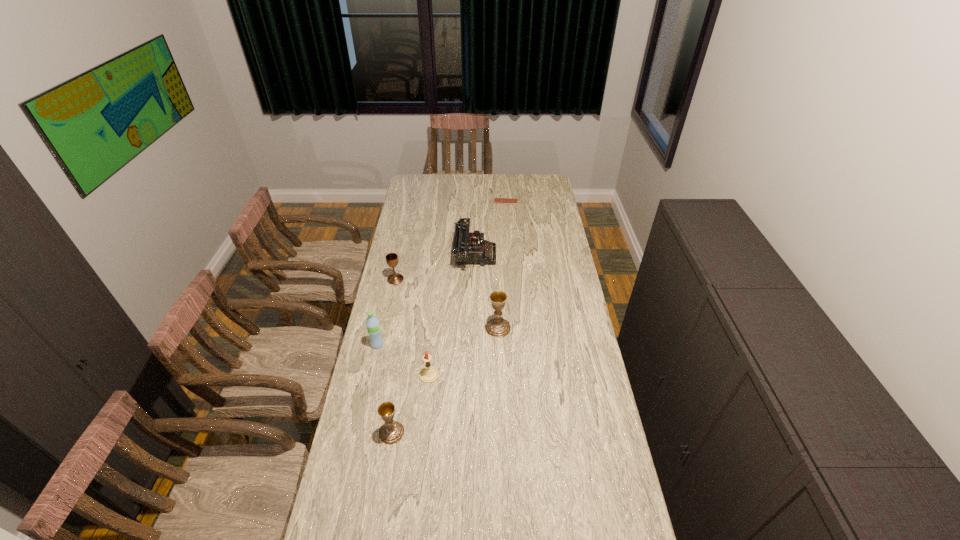
This screenshot has height=540, width=960. In order to click on the third nearest object in this screenshot , I will do `click(373, 327)`.

Identify the location of vacant area situated on the left of the nearest chalice. (352, 433).

I want to click on vacant space located on the front of the fourth nearest object, so click(x=501, y=406).

The width and height of the screenshot is (960, 540). I want to click on vacant space located on the back of the leftmost chalice, so pyautogui.click(x=400, y=256).

At what (x,y) coordinates should I click in order to perform the action: click on vacant area located 0.340m on the keyboard of the typewriter. Please return your answer as a coordinate pair (x, y). The height and width of the screenshot is (540, 960). Looking at the image, I should click on (564, 254).

Locate an element on the screen. The image size is (960, 540). free space located on the front of the chocolate bar is located at coordinates (509, 234).

Locate an element on the screen. The height and width of the screenshot is (540, 960). vacant space positioned on the front of the fourth object from right to left is located at coordinates (425, 412).

Where is `vacant space located on the front of the fifth farthest object`? The width and height of the screenshot is (960, 540). vacant space located on the front of the fifth farthest object is located at coordinates (359, 429).

At what (x,y) coordinates should I click in order to perform the action: click on water bottle that is at the left edge. Please return your answer as a coordinate pair (x, y). The height and width of the screenshot is (540, 960). Looking at the image, I should click on (373, 327).

At what (x,y) coordinates should I click in order to perform the action: click on free space at the far edge of the desktop. Please return your answer as a coordinate pair (x, y). Image resolution: width=960 pixels, height=540 pixels. Looking at the image, I should click on (442, 176).